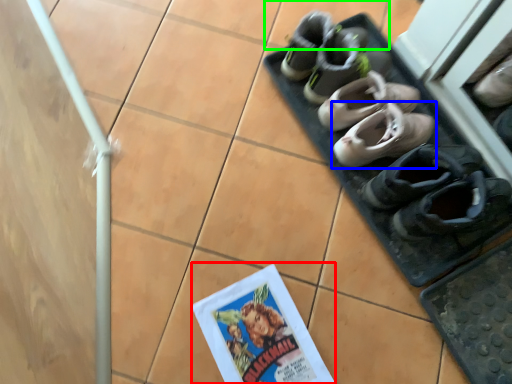
Question: Considering the real-world distances, which object is farthest from comic book (highlighted by a red box)? footwear (highlighted by a blue box) or tile (highlighted by a green box)?

Choices:
 (A) footwear
 (B) tile

Answer: (B)